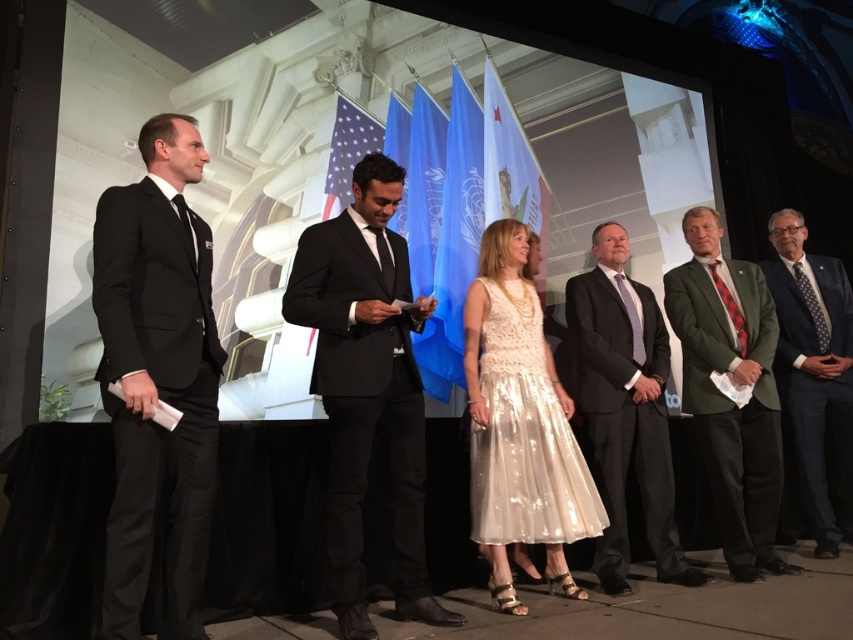
Question: Which point appears farthest from the camera in this image?

Choices:
 (A) (698, 296)
 (B) (376, 209)
 (C) (549, 538)

Answer: (A)

Question: Can you confirm if iridescent lace dress at center is thinner than dark blue suit at right?

Choices:
 (A) no
 (B) yes

Answer: (A)

Question: Is black matte suit at left below green wool suit at right?

Choices:
 (A) no
 (B) yes

Answer: (A)

Question: Among these objects, which one is farthest from the camera?

Choices:
 (A) black satin suit at center
 (B) iridescent lace dress at center

Answer: (B)

Question: Is black matte suit at left further to the viewer compared to dark blue suit at right?

Choices:
 (A) yes
 (B) no

Answer: (B)

Question: Based on their relative distances, which object is farther from the iridescent lace dress at center?

Choices:
 (A) green wool suit at right
 (B) dark blue suit at right
 (C) dark gray suit at center
 (D) black matte suit at left

Answer: (B)